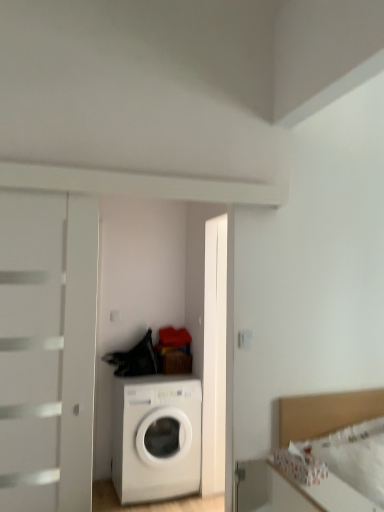
Find the location of a particular element. The height and width of the screenshot is (512, 384). white fabric bed at lower right is located at coordinates (326, 413).

The image size is (384, 512). Describe the element at coordinates (326, 413) in the screenshot. I see `white fabric bed at lower right` at that location.

This screenshot has height=512, width=384. Describe the element at coordinates (156, 437) in the screenshot. I see `white glossy washing machine at center` at that location.

Measure the distance between white glossy washing machine at center and camera.

A distance of 3.02 meters exists between white glossy washing machine at center and camera.

Where is `white glossy washing machine at center`? white glossy washing machine at center is located at coordinates (156, 437).

What are the coordinates of `white fabric bed at lower right` in the screenshot? It's located at (326, 413).

Considering the relative positions of white glossy washing machine at center and white fabric bed at lower right in the image provided, is white glossy washing machine at center to the left or to the right of white fabric bed at lower right?

white glossy washing machine at center is to the left of white fabric bed at lower right.

Who is more distant, white glossy washing machine at center or white fabric bed at lower right?

white glossy washing machine at center is behind.

Which is nearer, (155, 376) or (286, 409)?

The point (286, 409) is in front.

From the image's perspective, does white glossy washing machine at center appear lower than white fabric bed at lower right?

Correct, white glossy washing machine at center appears lower than white fabric bed at lower right in the image.

From a real-world perspective, is white glossy washing machine at center positioned above or below white fabric bed at lower right?

white glossy washing machine at center is below white fabric bed at lower right.

Can you confirm if white glossy washing machine at center is wider than white fabric bed at lower right?

Correct, the width of white glossy washing machine at center exceeds that of white fabric bed at lower right.

Considering the relative sizes of white glossy washing machine at center and white fabric bed at lower right in the image provided, is white glossy washing machine at center shorter than white fabric bed at lower right?

No.

Considering the relative sizes of white glossy washing machine at center and white fabric bed at lower right in the image provided, is white glossy washing machine at center bigger than white fabric bed at lower right?

Yes.

Is white glossy washing machine at center not inside white fabric bed at lower right?

white glossy washing machine at center is positioned outside white fabric bed at lower right.

Based on the photo, is white glossy washing machine at center placed right next to white fabric bed at lower right?

There is a gap between white glossy washing machine at center and white fabric bed at lower right.

Is white glossy washing machine at center turned away from white fabric bed at lower right?

white glossy washing machine at center does not have its back to white fabric bed at lower right.

Can you tell me how much white glossy washing machine at center and white fabric bed at lower right differ in facing direction?

The angular difference between white glossy washing machine at center and white fabric bed at lower right is 1.61 degrees.

The width and height of the screenshot is (384, 512). I want to click on bed that appears on the right of white glossy washing machine at center, so click(326, 413).

Can you confirm if white fabric bed at lower right is positioned to the left of white glossy washing machine at center?

In fact, white fabric bed at lower right is to the right of white glossy washing machine at center.

Considering the relative positions of white fabric bed at lower right and white glossy washing machine at center in the image provided, is white fabric bed at lower right behind white glossy washing machine at center?

No, it is in front of white glossy washing machine at center.

Does point (324, 409) come behind point (175, 377)?

No, it is in front of (175, 377).

From the image's perspective, which one is positioned lower, white fabric bed at lower right or white glossy washing machine at center?

white glossy washing machine at center is shown below in the image.

From a real-world perspective, is white fabric bed at lower right physically located above or below white glossy washing machine at center?

white fabric bed at lower right is situated higher than white glossy washing machine at center in the real world.

Is white fabric bed at lower right thinner than white glossy washing machine at center?

Yes.

Consider the image. Can you confirm if white fabric bed at lower right is taller than white glossy washing machine at center?

No, white fabric bed at lower right is not taller than white glossy washing machine at center.

Is white fabric bed at lower right smaller than white glossy washing machine at center?

Correct, white fabric bed at lower right occupies less space than white glossy washing machine at center.

From the picture: Is white fabric bed at lower right positioned beyond the bounds of white glossy washing machine at center?

Yes.

Are white fabric bed at lower right and white glossy washing machine at center beside each other?

white fabric bed at lower right and white glossy washing machine at center are clearly separated.

Is white fabric bed at lower right looking in the opposite direction of white glossy washing machine at center?

Absolutely, white fabric bed at lower right is directed away from white glossy washing machine at center.

Image resolution: width=384 pixels, height=512 pixels. Find the location of `washing machine directly beneath the white fabric bed at lower right (from a real-world perspective)`. washing machine directly beneath the white fabric bed at lower right (from a real-world perspective) is located at coordinates (156, 437).

Find the location of a particular element. Image resolution: width=384 pixels, height=512 pixels. bed on the right side of white glossy washing machine at center is located at coordinates tap(326, 413).

The width and height of the screenshot is (384, 512). Find the location of `bed in front of the white glossy washing machine at center`. bed in front of the white glossy washing machine at center is located at coordinates (326, 413).